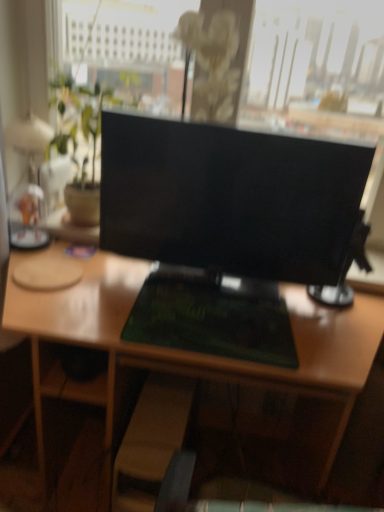
Locate an element on the screen. green matte desk at center is located at coordinates (188, 353).

The height and width of the screenshot is (512, 384). I want to click on wooden swivel chair at lower center, so click(x=151, y=441).

From a real-world perspective, is white fabric lampshade at left positioned over black glossy monitor at center based on gravity?

No, from a real-world perspective, white fabric lampshade at left is not over black glossy monitor at center

Which point is more forward, (15, 242) or (241, 152)?

Point (241, 152)

Is white fabric lampshade at left outside of black glossy monitor at center?

Absolutely, white fabric lampshade at left is external to black glossy monitor at center.

From the image's perspective, is wooden swivel chair at lower center below white fabric lampshade at left?

Yes, from the image's perspective, wooden swivel chair at lower center is beneath white fabric lampshade at left.

You are a GUI agent. You are given a task and a screenshot of the screen. Output one action in this format:
    pyautogui.click(x=<x>, y=<y>)
    Task: Click on the swivel chair below the white fabric lampshade at left (from the image's perspective)
    The width and height of the screenshot is (384, 512).
    Given the screenshot: What is the action you would take?
    pyautogui.click(x=151, y=441)

Does wooden swivel chair at lower center have a smaller size compared to white fabric lampshade at left?

No.

Consider the image. Is wooden swivel chair at lower center in front of or behind white fabric lampshade at left in the image?

Visually, wooden swivel chair at lower center is located in front of white fabric lampshade at left.

How far apart are black glossy monitor at center and wooden swivel chair at lower center?

They are 68.10 centimeters apart.

From the image's perspective, is black glossy monitor at center above or below wooden swivel chair at lower center?

From the image's perspective, black glossy monitor at center appears above wooden swivel chair at lower center.

Is point (255, 164) farther from camera compared to point (144, 478)?

That is False.

This screenshot has width=384, height=512. In the image, there is a black glossy monitor at center. What are the coordinates of `swivel chair below it (from a real-world perspective)` in the screenshot? It's located at (151, 441).

Considering the relative sizes of wooden swivel chair at lower center and black glossy monitor at center in the image provided, is wooden swivel chair at lower center shorter than black glossy monitor at center?

Correct, wooden swivel chair at lower center is not as tall as black glossy monitor at center.

Considering the relative sizes of wooden swivel chair at lower center and black glossy monitor at center in the image provided, is wooden swivel chair at lower center bigger than black glossy monitor at center?

Incorrect, wooden swivel chair at lower center is not larger than black glossy monitor at center.

Can you tell me how much wooden swivel chair at lower center and black glossy monitor at center differ in facing direction?

The facing directions of wooden swivel chair at lower center and black glossy monitor at center are 3.3 degrees apart.

Is there a large distance between wooden swivel chair at lower center and black glossy monitor at center?

They are positioned close to each other.

Based on their sizes in the image, would you say white fabric lampshade at left is bigger or smaller than green matte desk at center?

In the image, white fabric lampshade at left appears to be smaller than green matte desk at center.

Is green matte desk at center a part of white fabric lampshade at left?

No, green matte desk at center is not a part of white fabric lampshade at left.

Which of these two, white fabric lampshade at left or green matte desk at center, stands shorter?

white fabric lampshade at left is shorter.

Which object is closer to the camera, white fabric lampshade at left or green matte desk at center?

Positioned in front is green matte desk at center.

In the image, is white fabric lampshade at left positioned in front of or behind wooden swivel chair at lower center?

In the image, white fabric lampshade at left appears behind wooden swivel chair at lower center.

Does white fabric lampshade at left have a lesser height compared to wooden swivel chair at lower center?

Indeed, white fabric lampshade at left has a lesser height compared to wooden swivel chair at lower center.

Considering the relative positions of white fabric lampshade at left and wooden swivel chair at lower center in the image provided, is white fabric lampshade at left to the left of wooden swivel chair at lower center from the viewer's perspective?

Yes.

Is white fabric lampshade at left smaller than wooden swivel chair at lower center?

Indeed, white fabric lampshade at left has a smaller size compared to wooden swivel chair at lower center.

In the scene shown: Which of these two, black glossy monitor at center or green matte desk at center, stands shorter?

black glossy monitor at center.

Could you tell me if black glossy monitor at center is facing green matte desk at center?

No, black glossy monitor at center is not oriented towards green matte desk at center.

Is point (251, 166) closer or farther from the camera than point (310, 334)?

Point (251, 166) is farther from the camera than point (310, 334).

Is black glossy monitor at center positioned far away from green matte desk at center?

No, black glossy monitor at center is in close proximity to green matte desk at center.

Where is `table lamp located on the left of black glossy monitor at center`? table lamp located on the left of black glossy monitor at center is located at coordinates (28, 219).

The image size is (384, 512). Find the location of `swivel chair located underneath the white fabric lampshade at left (from a real-world perspective)`. swivel chair located underneath the white fabric lampshade at left (from a real-world perspective) is located at coordinates (151, 441).

Looking at this image, considering their positions, is wooden swivel chair at lower center positioned closer to black glossy monitor at center than green matte desk at center?

green matte desk at center.

Considering their positions, is wooden swivel chair at lower center positioned further to green matte desk at center than white fabric lampshade at left?

Among the two, white fabric lampshade at left is located further to green matte desk at center.

From the image, which object appears to be nearer to white fabric lampshade at left, black glossy monitor at center or green matte desk at center?

The object closer to white fabric lampshade at left is green matte desk at center.

Looking at the image, which one is located closer to wooden swivel chair at lower center, black glossy monitor at center or green matte desk at center?

green matte desk at center is closer to wooden swivel chair at lower center.

Looking at the image, which one is located further to wooden swivel chair at lower center, black glossy monitor at center or white fabric lampshade at left?

white fabric lampshade at left.

Estimate the real-world distances between objects in this image. Which object is further from black glossy monitor at center, white fabric lampshade at left or green matte desk at center?

white fabric lampshade at left lies further to black glossy monitor at center than the other object.

From the image, which object appears to be farther from wooden swivel chair at lower center, green matte desk at center or white fabric lampshade at left?

The object further to wooden swivel chair at lower center is white fabric lampshade at left.

Looking at the image, which one is located further to white fabric lampshade at left, wooden swivel chair at lower center or black glossy monitor at center?

Among the two, wooden swivel chair at lower center is located further to white fabric lampshade at left.

Where is `desk between white fabric lampshade at left and wooden swivel chair at lower center from top to bottom`? The image size is (384, 512). desk between white fabric lampshade at left and wooden swivel chair at lower center from top to bottom is located at coordinates (188, 353).

Image resolution: width=384 pixels, height=512 pixels. In order to click on desk that lies between black glossy monitor at center and wooden swivel chair at lower center from top to bottom in this screenshot , I will do `click(188, 353)`.

Image resolution: width=384 pixels, height=512 pixels. I want to click on computer monitor between white fabric lampshade at left and green matte desk at center in the vertical direction, so click(230, 198).

Find the location of `computer monitor between white fabric lampshade at left and wooden swivel chair at lower center from top to bottom`. computer monitor between white fabric lampshade at left and wooden swivel chair at lower center from top to bottom is located at coordinates (230, 198).